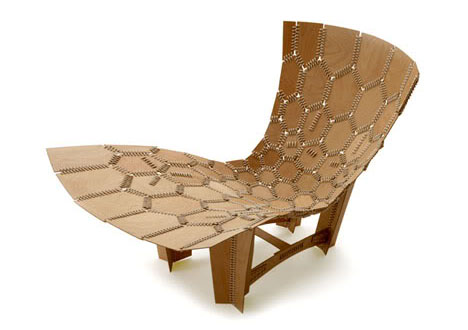
Find the location of a particular element. right back chair leg is located at coordinates (335, 217).